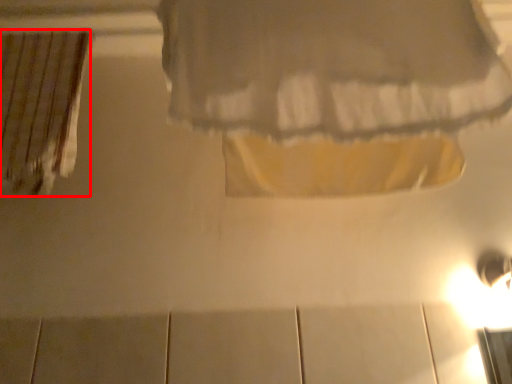
Question: From the image's perspective, where is curtain (annotated by the red box) located in relation to curtain in the image?

Choices:
 (A) below
 (B) above

Answer: (A)